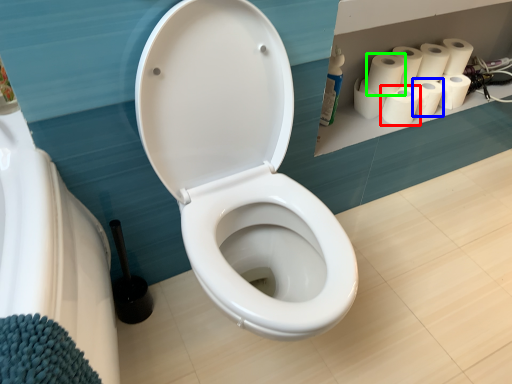
Question: Which object is positioned farthest from paper towel (highlighted by a red box)? Select from paper towel (highlighted by a blue box) and paper towel (highlighted by a green box).

Choices:
 (A) paper towel
 (B) paper towel

Answer: (B)